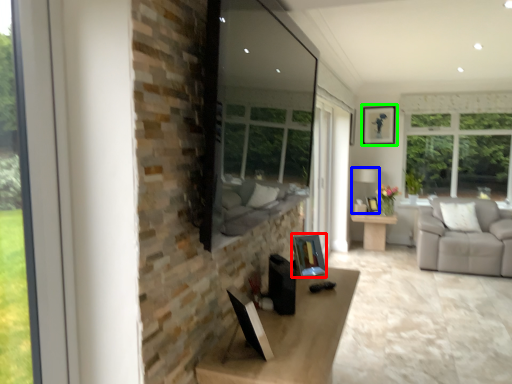
Question: Which object is the farthest from picture frame (highlighted by a red box)? Choose among these: lamp (highlighted by a blue box) or picture frame (highlighted by a green box).

Choices:
 (A) lamp
 (B) picture frame

Answer: (B)